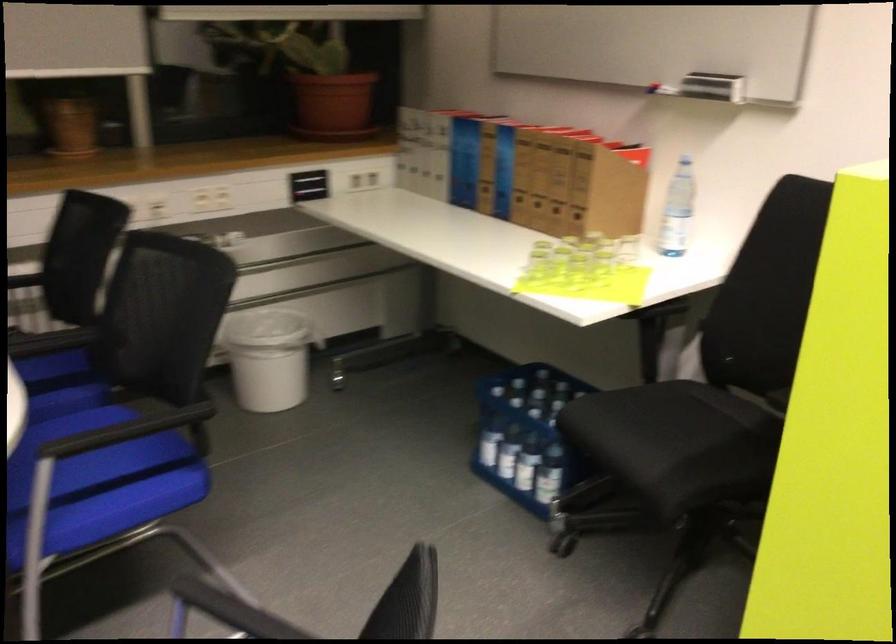
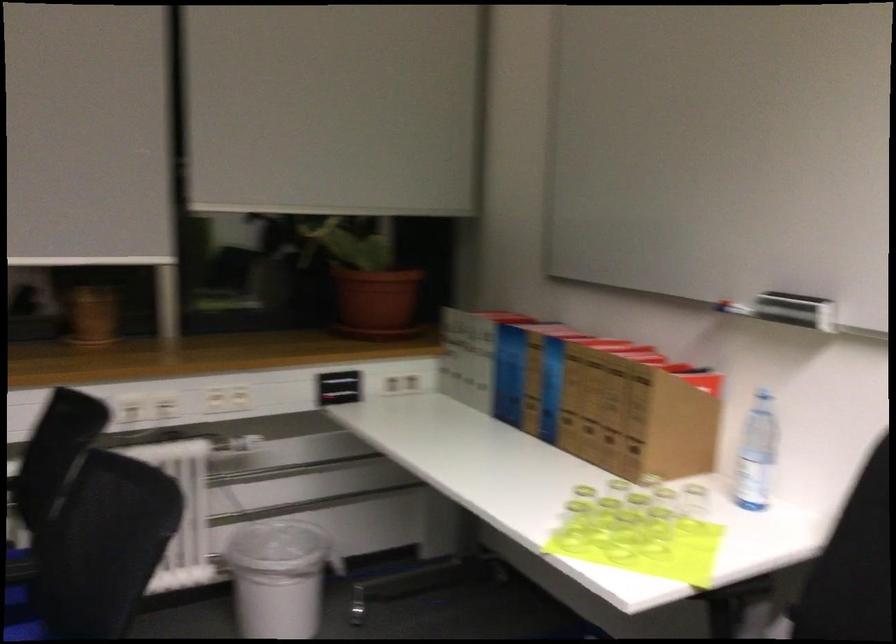
Question: I am providing you with two images of the same scene from different viewpoints. After the viewpoint changes to image2, which objects are now occluded?

Choices:
 (A) whiteboard eraser
 (B) terracotta plant pot
 (C) blue file binder
 (D) none of these

Answer: (D)